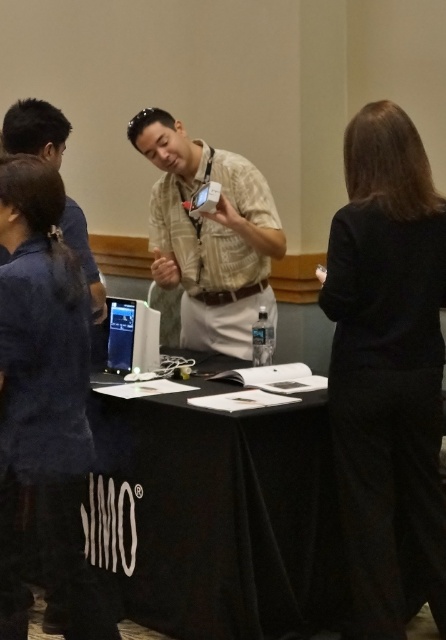
Question: From the image, what is the correct spatial relationship of dark blue fabric at left in relation to beige textured shirt at center?

Choices:
 (A) below
 (B) above

Answer: (A)

Question: Which of the following is the closest to the observer?

Choices:
 (A) black fabric skirt at lower right
 (B) beige textured shirt at center
 (C) black fabric table at center
 (D) dark blue fabric at left

Answer: (D)

Question: Is black fabric table at center above dark blue shirt at upper left?

Choices:
 (A) yes
 (B) no

Answer: (B)

Question: Among these objects, which one is farthest from the camera?

Choices:
 (A) dark blue fabric at left
 (B) dark blue shirt at upper left
 (C) black fabric table at center
 (D) beige textured shirt at center

Answer: (D)

Question: Which point appears farthest from the camera in this image?

Choices:
 (A) (185, 595)
 (B) (29, 100)
 (C) (401, 419)

Answer: (B)

Question: Is beige textured shirt at center closer to the viewer compared to dark blue shirt at upper left?

Choices:
 (A) no
 (B) yes

Answer: (A)